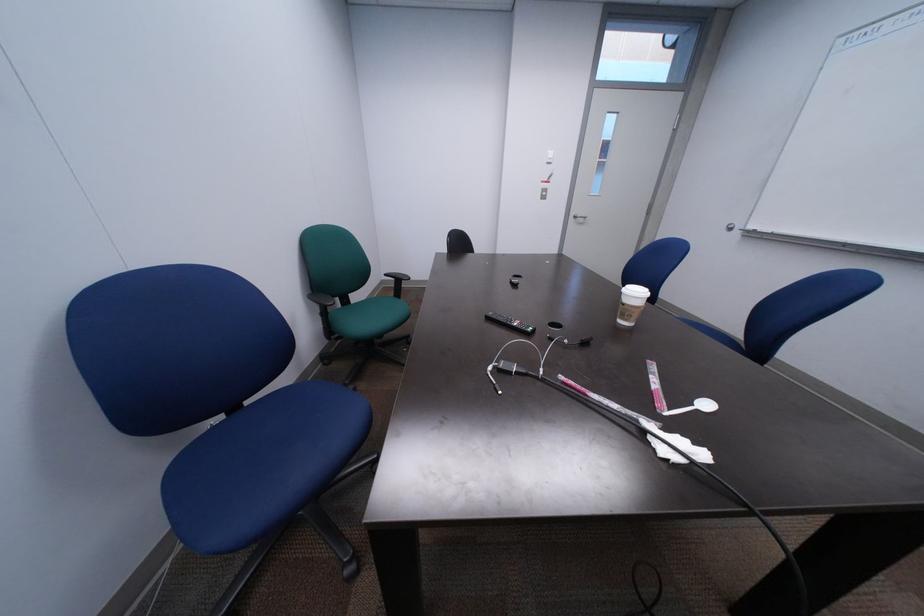
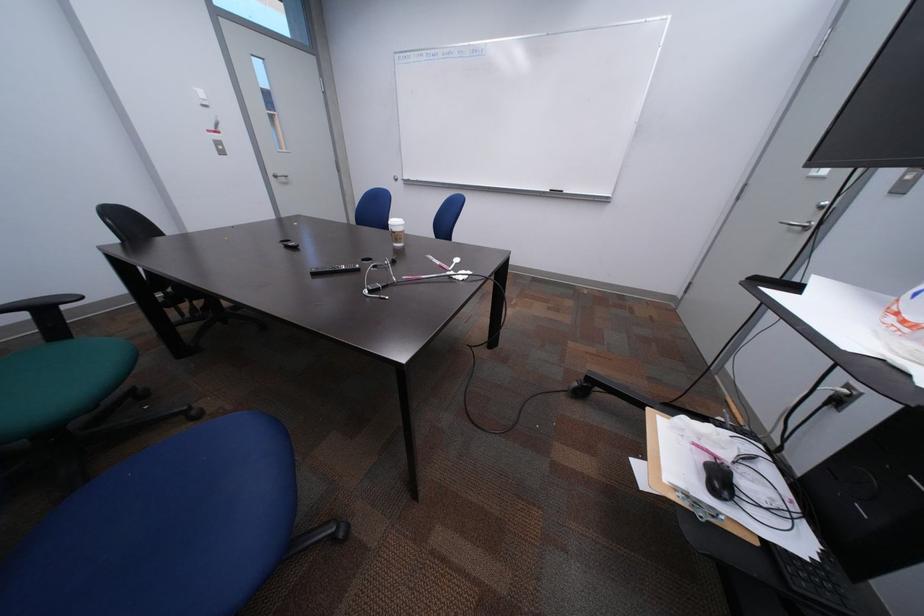
How did the camera likely rotate?

The camera's rotation is toward right-down.